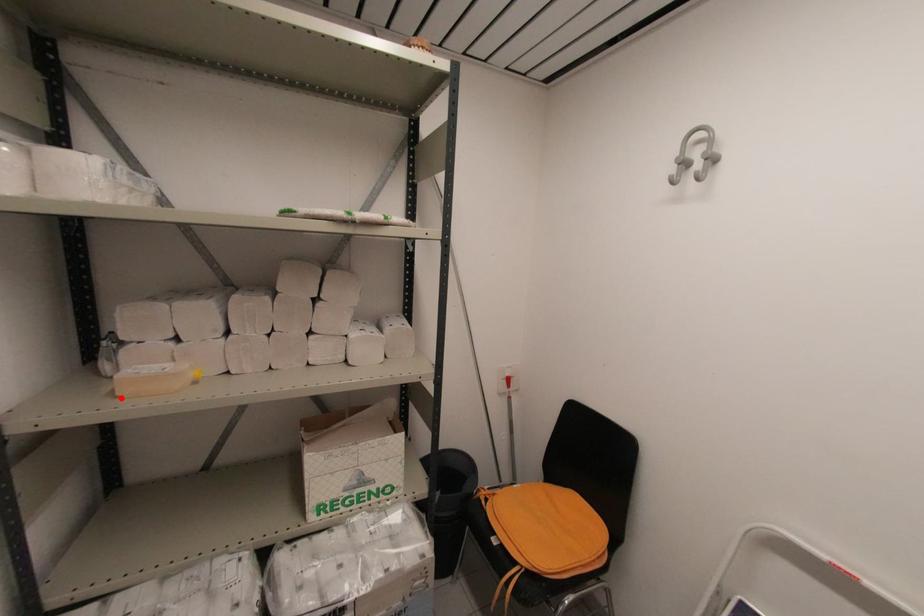
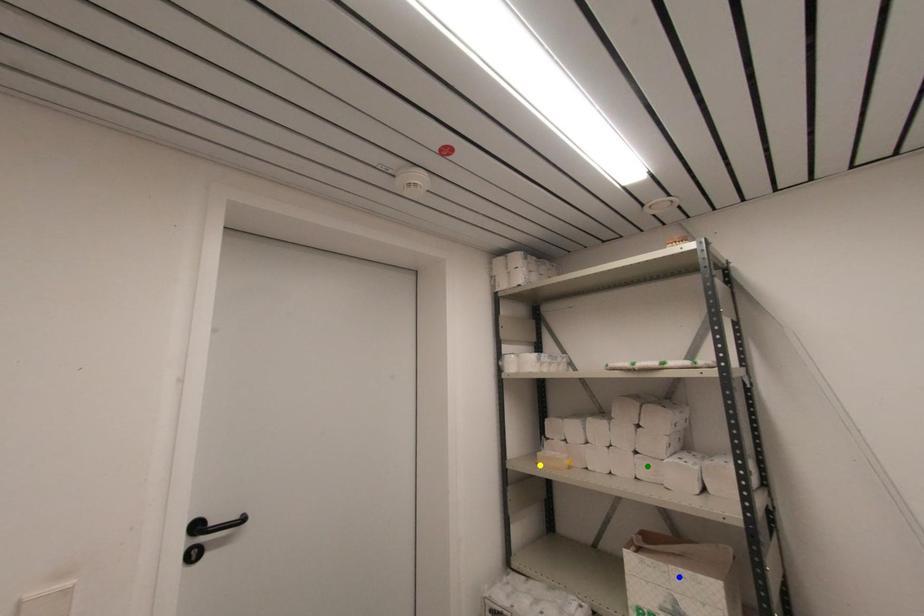
Question: I am providing you with two images of the same scene from different viewpoints. A red point is marked on the first image. You are given multiple points on the second image. Which point in image 2 represents the same 3d spot as the red point in image 1?

Choices:
 (A) green point
 (B) yellow point
 (C) blue point

Answer: (B)